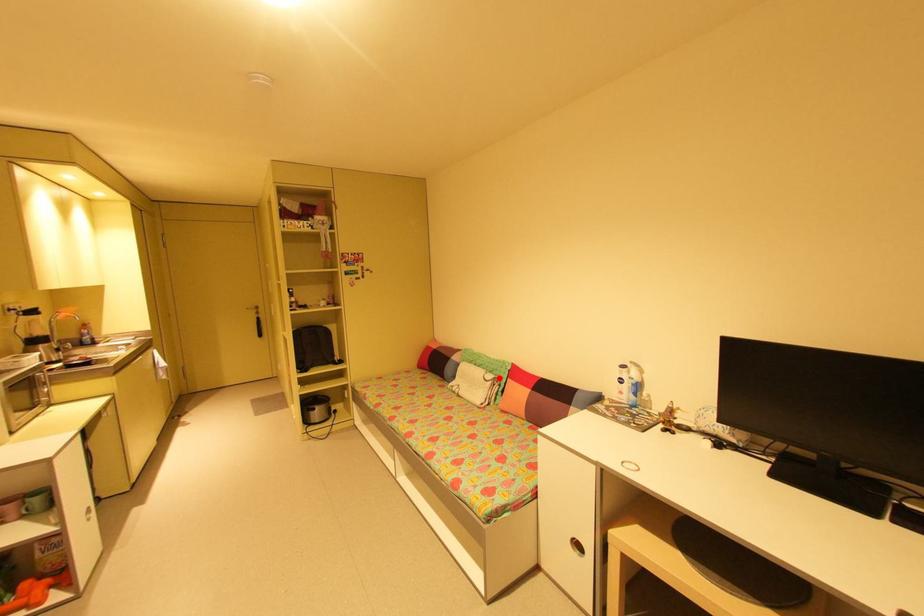
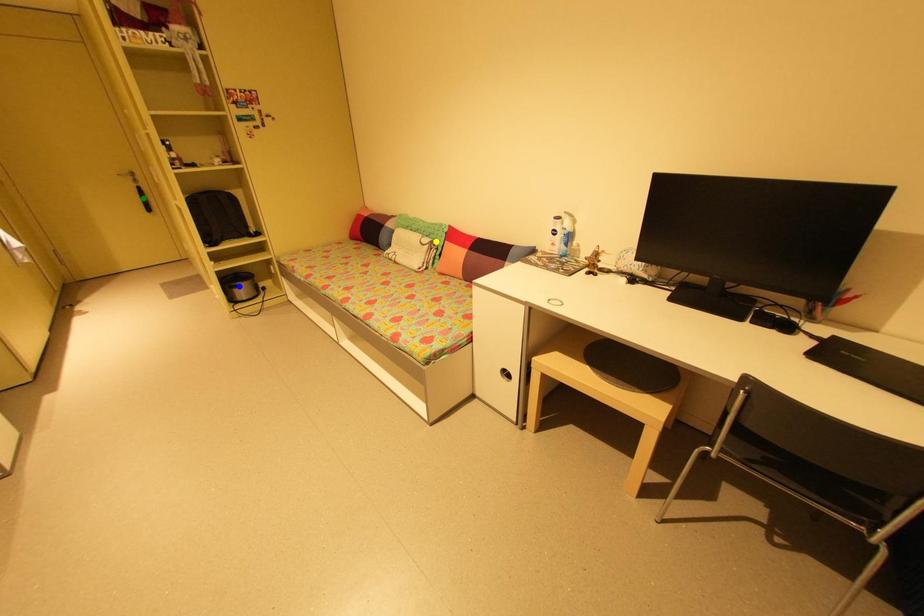
Question: I am providing you with two images of the same scene from different viewpoints. A red point is marked on the first image. You are given multiple points on the second image. Can you choose the point in image 2 that corresponds to the point in image 1?

Choices:
 (A) yellow point
 (B) green point
 (C) blue point

Answer: (A)